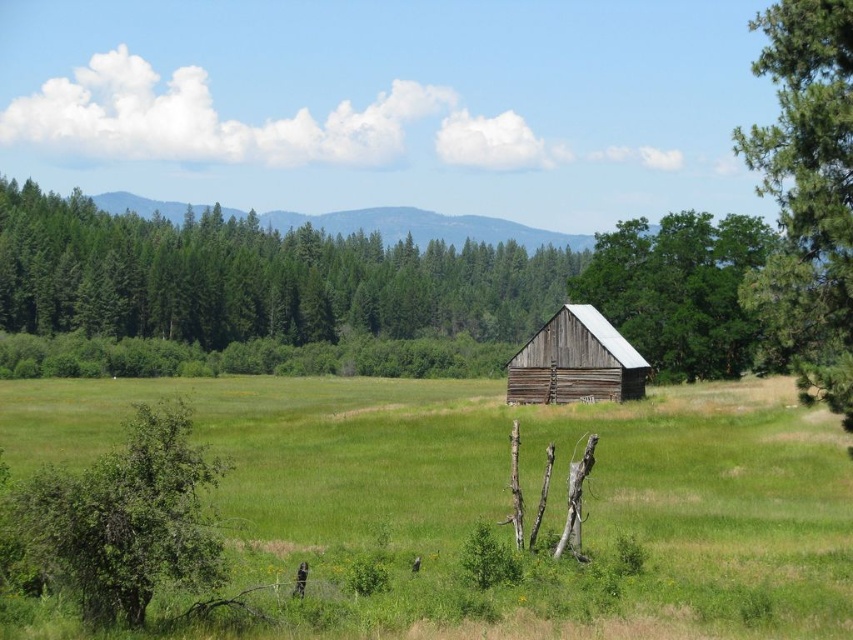
Consider the image. You are a bird looking for a place to rest. You see the green leafy tree at lower left and the green rough wood barn at center. Which one is taller?

The green leafy tree at lower left is shorter than the green rough wood barn at center, so the barn is taller.

You are standing in the field and want to walk towards the green textured trees at upper left. Which direction should you walk to avoid the green leafy tree at lower left?

Since the green textured trees at upper left is above the green leafy tree at lower left, you should walk upwards to reach the green textured trees at upper left while avoiding the green leafy tree at lower left located below.

You are an observer looking at the rural landscape. You notice the green textured trees at upper left and the green leafy tree at lower left. Which of these two trees is taller?

The green textured trees at upper left is taller than the green leafy tree at lower left.